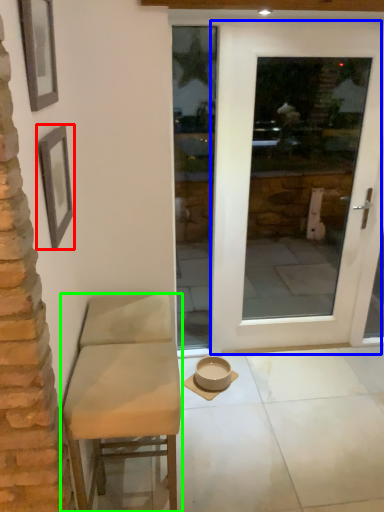
Question: Which is nearer to the picture frame (highlighted by a red box)? door (highlighted by a blue box) or chair (highlighted by a green box).

Choices:
 (A) door
 (B) chair

Answer: (B)